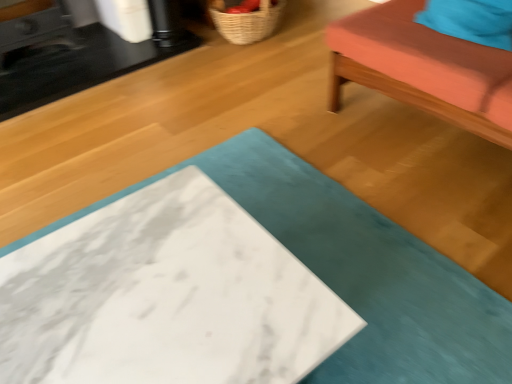
Question: Is woven straw basket at upper center bigger or smaller than teal fabric pillow at upper right?

Choices:
 (A) big
 (B) small

Answer: (A)

Question: Considering the relative positions of woven straw basket at upper center and teal fabric pillow at upper right in the image provided, is woven straw basket at upper center to the left or to the right of teal fabric pillow at upper right?

Choices:
 (A) left
 (B) right

Answer: (A)

Question: Which object is the closest to the teal fabric cushion at upper right?

Choices:
 (A) black marble table at upper left, which ranks as the second table in bottom-to-top order
 (B) woven straw basket at upper center
 (C) teal fabric pillow at upper right
 (D) white marble table at center, which is the second table in top-to-bottom order

Answer: (C)

Question: Which object is positioned farthest from the teal fabric pillow at upper right?

Choices:
 (A) white marble table at center, arranged as the 1th table when ordered from the bottom
 (B) teal fabric cushion at upper right
 (C) black marble table at upper left, the second table from the front
 (D) woven straw basket at upper center

Answer: (C)